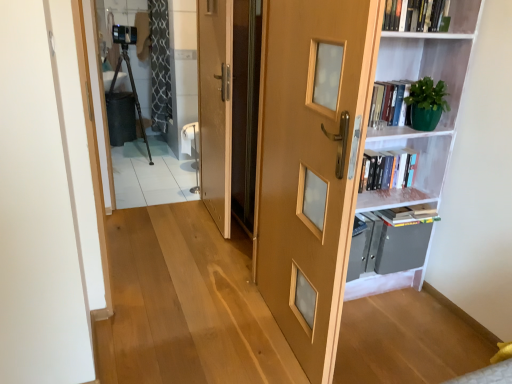
Where is `empty space that is in between wooden door at center, the first door viewed from the left, and clear glass door at upper left`? empty space that is in between wooden door at center, the first door viewed from the left, and clear glass door at upper left is located at coordinates (177, 221).